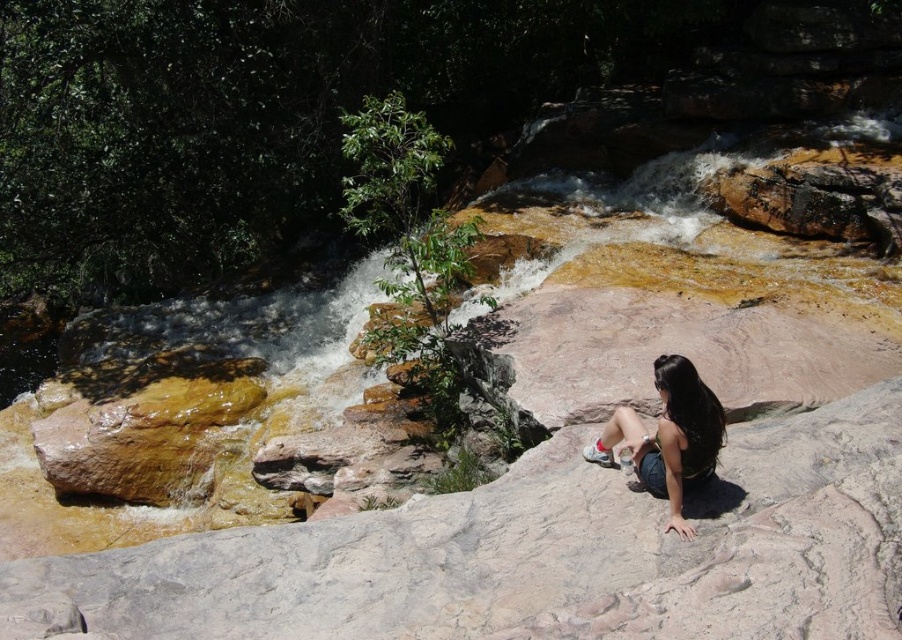
Which is above, smooth gray rock at center or matte black hair at center?

matte black hair at center is above.

Which of these two, smooth gray rock at center or matte black hair at center, stands taller?

smooth gray rock at center is taller.

Is point (821, 620) more distant than point (603, 433)?

No, (821, 620) is closer to viewer.

Image resolution: width=902 pixels, height=640 pixels. What are the coordinates of `smooth gray rock at center` in the screenshot? It's located at (532, 556).